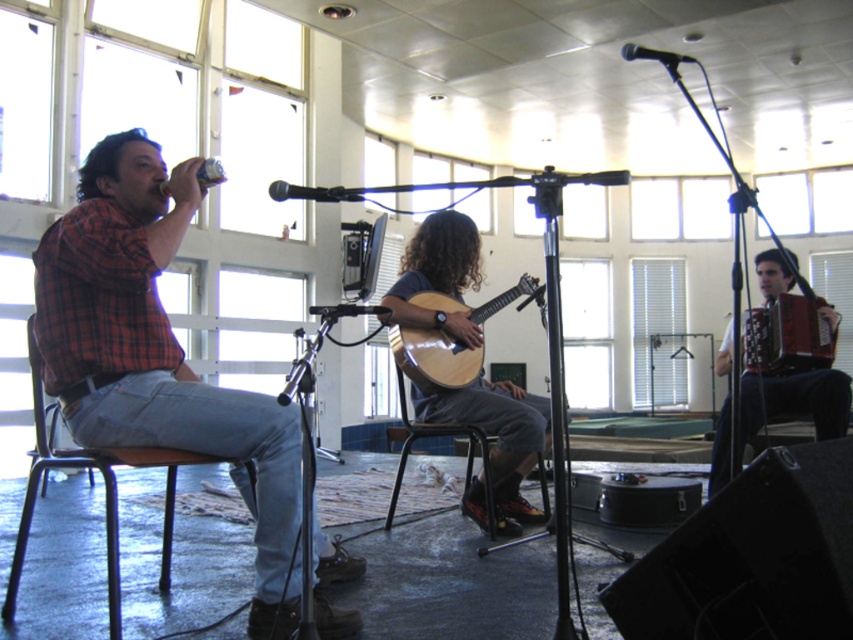
You are standing at the origin point of the coordinate system in this room. You need to move towards the point at the bottom right corner of the room. Which point should you head towards, point (334,611) or point (325,198)?

You should head towards point (334,611) because it is located behind point (325,198), meaning it is closer to the bottom right corner of the room.

You are setting up a photo shoot in the room. You need to place a large tripod that requires 1.2 meters of space. There is a metallic brown chair at left and a wooden acoustic guitar at center in the scene. Can the space between these two objects accommodate the tripod?

The metallic brown chair at left has a larger size compared to wooden acoustic guitar at center. However, the exact distance between them isn not specified in the provided information. Without knowing the distance, it is impossible to determine if the 1.2 meters of space required for the tripod is available.

You are standing at the point labeled as point (126, 449) and want to move towards the point labeled as point (471, 321). Which direction should you move to reach your destination?

To reach point (471, 321) from point (126, 449), you should move backward since point (126, 449) is in front of point (471, 321).